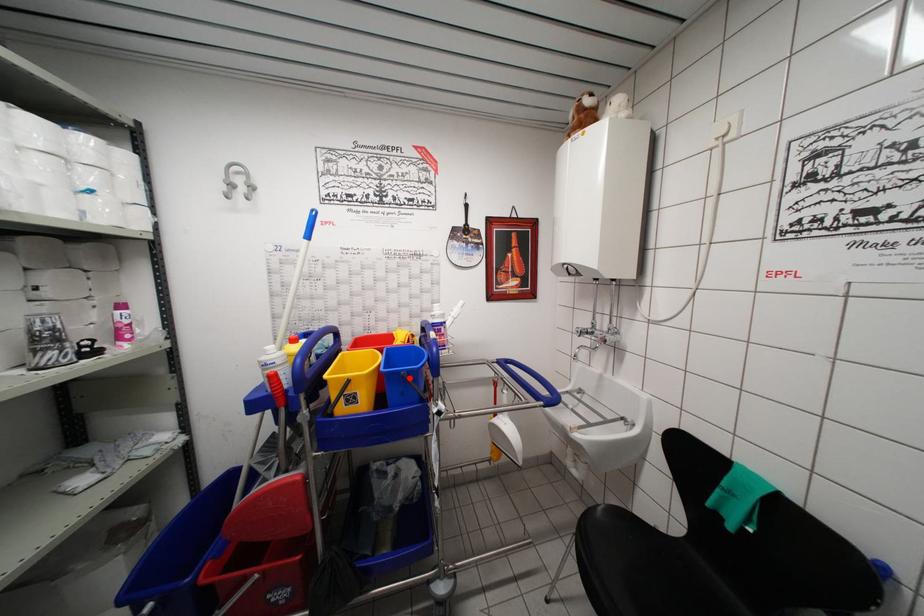
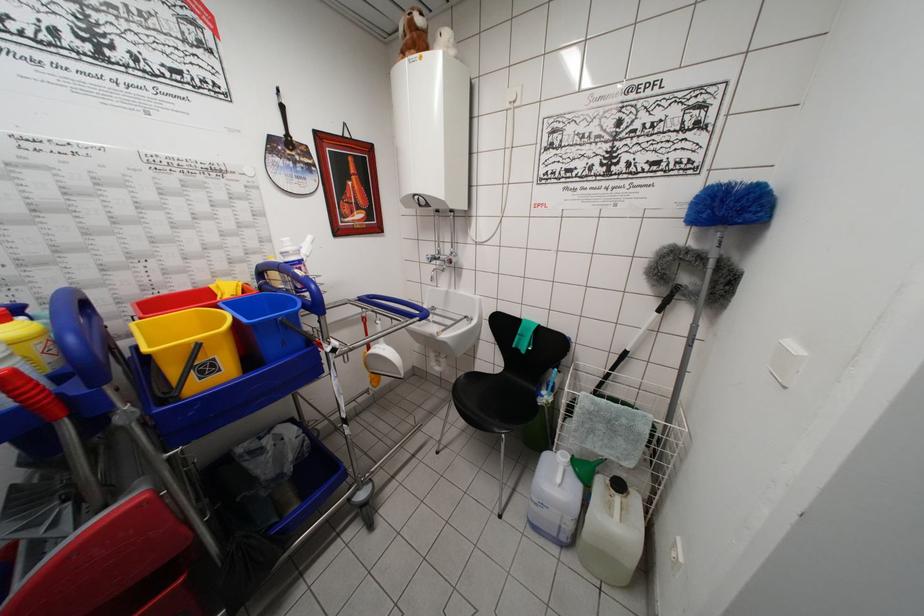
Where in the second image is the point corresponding to the highlighted location from the first image?

(287, 323)